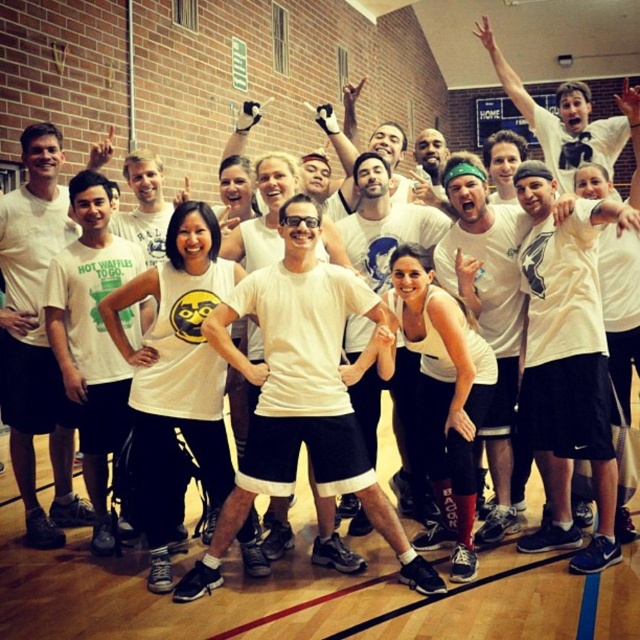
You are standing in the gymnasium and see two points marked on the floor. The first point is labeled as point (326, 324) and the second is point (3, 321). Which point is closer to you?

Point (326, 324) is closer to the viewer than point (3, 321).